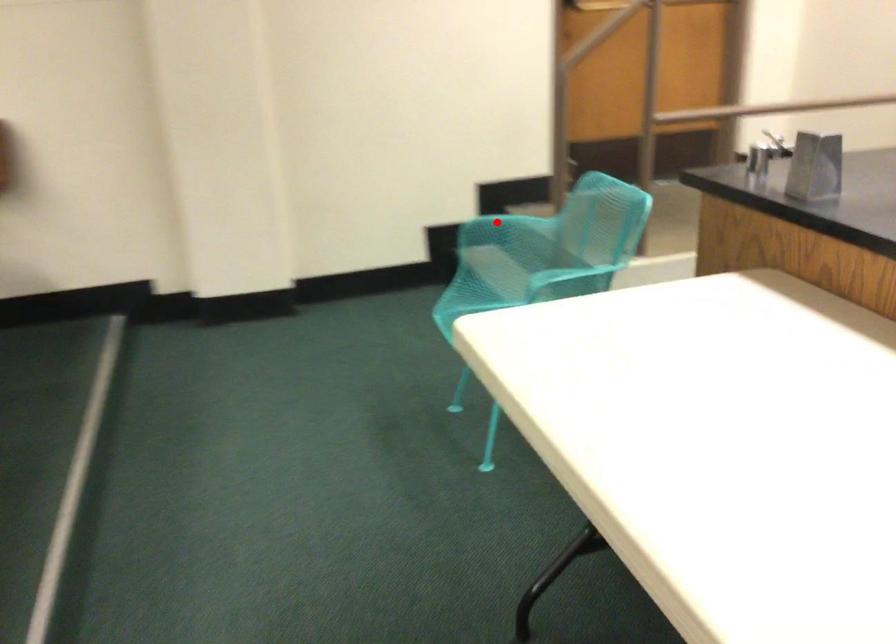
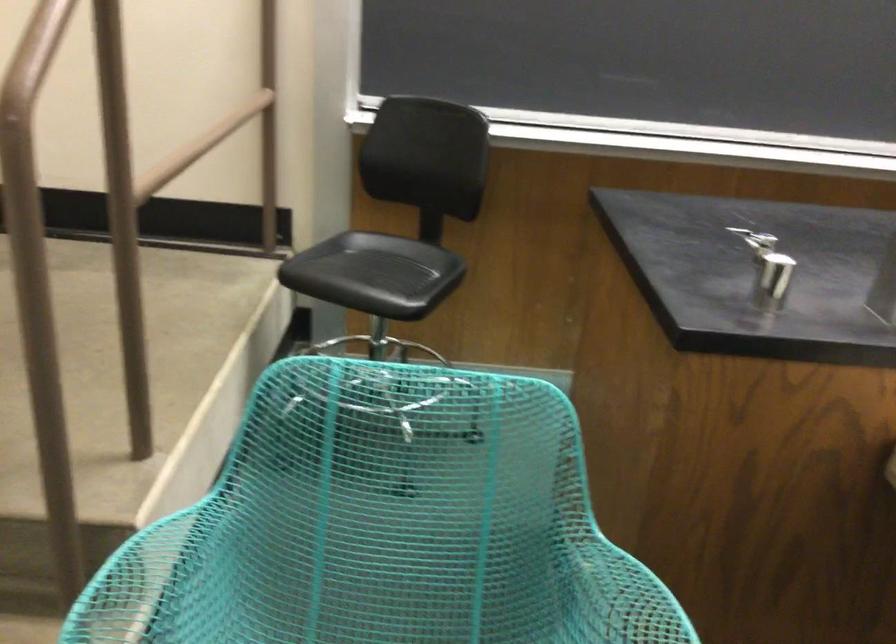
Question: I am providing you with two images of the same scene from different viewpoints. A red point is shown in image1. For the corresponding object point in image2, is it positioned nearer or farther from the camera?

Choices:
 (A) Nearer
 (B) Farther

Answer: (A)